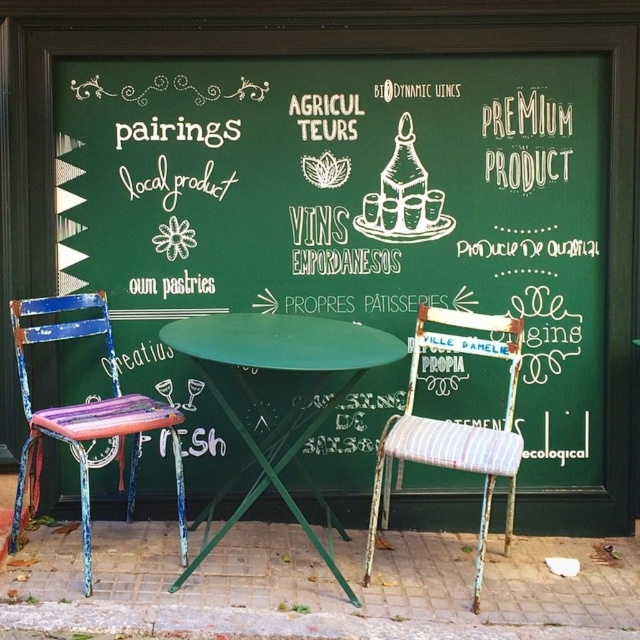
What do you see at coordinates (358, 204) in the screenshot? I see `green chalkboard at center` at bounding box center [358, 204].

In the scene shown: Is green chalkboard at center to the left of distressed wood chair at left from the viewer's perspective?

In fact, green chalkboard at center is to the right of distressed wood chair at left.

Who is more forward, (568, 340) or (72, 449)?

Point (72, 449) is in front.

You are a GUI agent. You are given a task and a screenshot of the screen. Output one action in this format:
    pyautogui.click(x=<x>, y=<y>)
    Task: Click on the green chalkboard at center
    The width and height of the screenshot is (640, 640).
    Given the screenshot: What is the action you would take?
    pyautogui.click(x=358, y=204)

Does green chalkboard at center appear on the right side of green metal table at center?

Yes, green chalkboard at center is to the right of green metal table at center.

Between green chalkboard at center and green metal table at center, which one is positioned lower?

green metal table at center is lower down.

The width and height of the screenshot is (640, 640). Describe the element at coordinates (358, 204) in the screenshot. I see `green chalkboard at center` at that location.

I want to click on green chalkboard at center, so click(x=358, y=204).

Is green metal table at center above striped fabric chair at center?

Yes.

Is green metal table at center below striped fabric chair at center?

No, green metal table at center is not below striped fabric chair at center.

Who is more forward, (259,483) or (436,336)?

Point (259,483) is more forward.

You are a GUI agent. You are given a task and a screenshot of the screen. Output one action in this format:
    pyautogui.click(x=<x>, y=<y>)
    Task: Click on the green metal table at center
    The image size is (640, 640).
    Given the screenshot: What is the action you would take?
    pyautogui.click(x=291, y=410)